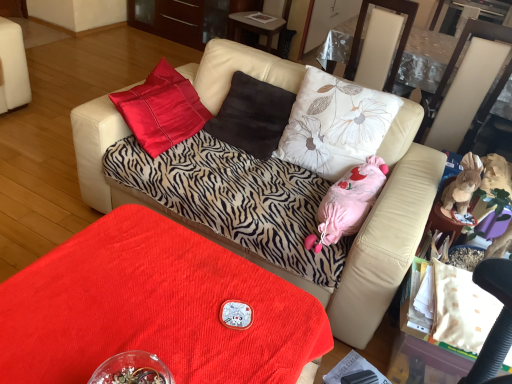
Locate an element on the screen. The width and height of the screenshot is (512, 384). free point above velvet red table at lower center (from a real-world perspective) is located at coordinates (143, 304).